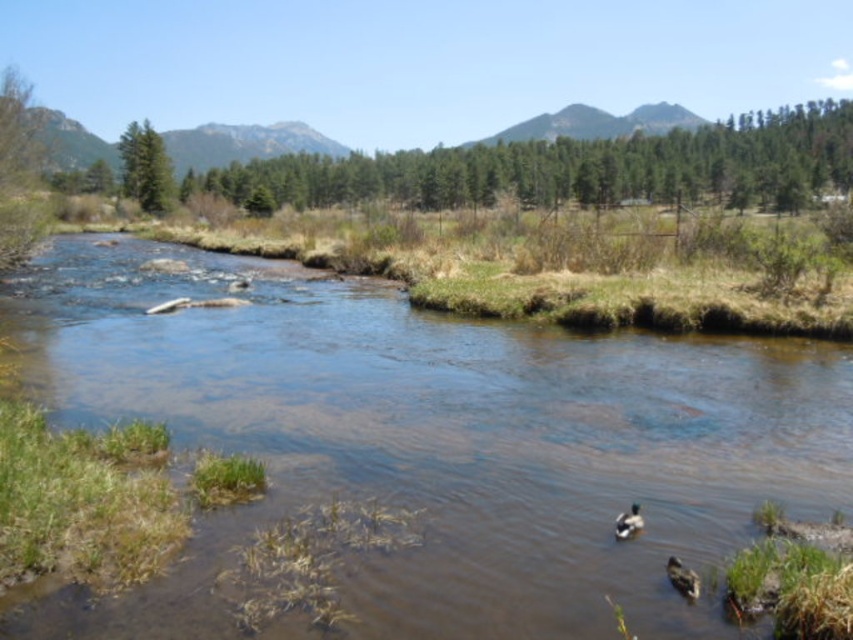
Does clear water at center have a lesser height compared to brown fuzzy duck at lower center?

Incorrect, clear water at center's height does not fall short of brown fuzzy duck at lower center's.

Who is more forward, (527, 465) or (631, 518)?

A: Point (631, 518) is more forward.

Which is in front, point (196, 596) or point (625, 534)?

Positioned in front is point (196, 596).

The width and height of the screenshot is (853, 640). I want to click on clear water at center, so click(431, 444).

Measure the distance between point (680,592) and camera.

The distance of point (680,592) from camera is 7.04 meters.

Can you confirm if brown matte duck at lower right is positioned below brown fuzzy duck at lower center?

Yes, brown matte duck at lower right is below brown fuzzy duck at lower center.

Is point (669, 561) more distant than point (634, 513)?

No, it is not.

This screenshot has width=853, height=640. What are the coordinates of `brown matte duck at lower right` in the screenshot? It's located at (682, 577).

Is clear water at center taller than brown matte duck at lower right?

Indeed, clear water at center has a greater height compared to brown matte duck at lower right.

Does clear water at center appear under brown matte duck at lower right?

Actually, clear water at center is above brown matte duck at lower right.

This screenshot has height=640, width=853. What are the coordinates of `clear water at center` in the screenshot? It's located at (431, 444).

The image size is (853, 640). In order to click on clear water at center in this screenshot , I will do `click(431, 444)`.